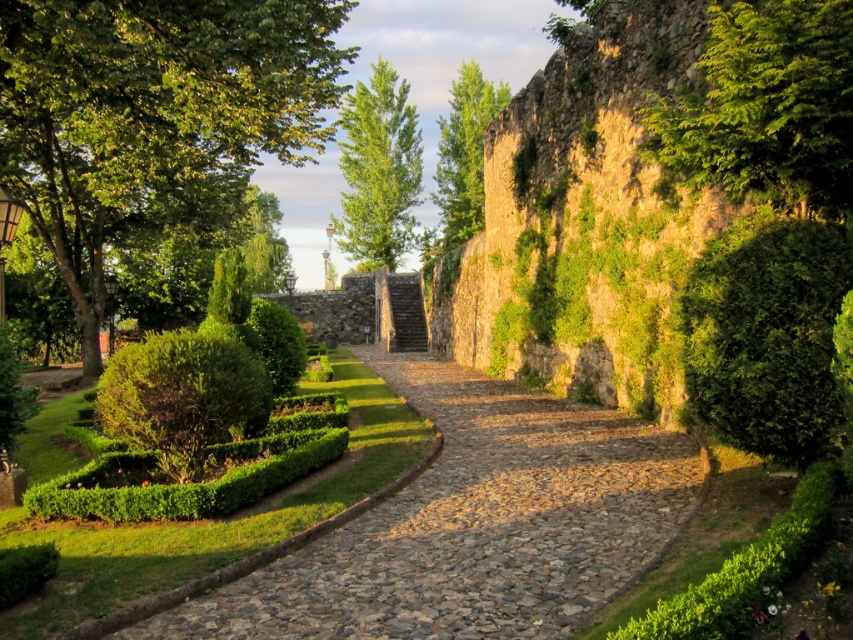
Is brown cobblestone path at center to the right of green leafy tree at left from the viewer's perspective?

Indeed, brown cobblestone path at center is positioned on the right side of green leafy tree at left.

Who is more distant from viewer, [497,452] or [73,150]?

The point [73,150] is more distant.

Locate an element on the screen. This screenshot has height=640, width=853. brown cobblestone path at center is located at coordinates (473, 524).

Describe the element at coordinates (149, 108) in the screenshot. I see `green leafy tree at left` at that location.

In order to click on green leafy tree at left in this screenshot , I will do `click(149, 108)`.

Is green leafy tree at upper right to the right of green leafy tree at upper center from the viewer's perspective?

Indeed, green leafy tree at upper right is positioned on the right side of green leafy tree at upper center.

Is green leafy tree at upper right to the left of green leafy tree at upper center from the viewer's perspective?

In fact, green leafy tree at upper right is to the right of green leafy tree at upper center.

This screenshot has width=853, height=640. In order to click on green leafy tree at upper right in this screenshot , I will do `click(766, 108)`.